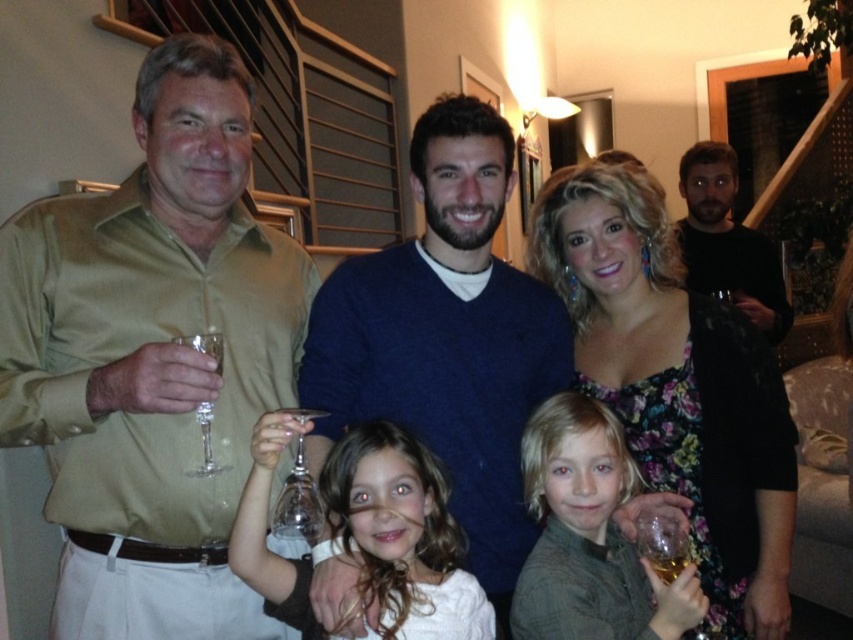
You are standing at the position of point (202, 456) and want to move towards the staircase located at point (390, 264). Can you walk directly to the staircase without needing to go around any obstacles?

Point (390, 264) is behind point (202, 456), so you can walk directly towards the staircase at point (390, 264) without needing to go around any obstacles since it is in your path.

You are a photographer trying to capture a candid shot of the floral dress at center and the translucent glass wine glass at lower right. You need to ensure that both subjects are in focus. Given that your camera has a depth of field that can cover up to 16 inches, will you be able to achieve this?

The distance between the floral dress at center and the translucent glass wine glass at lower right is 16.85 inches. Since the camera can only cover up to 16 inches, the depth of field is insufficient to keep both in focus simultaneously.